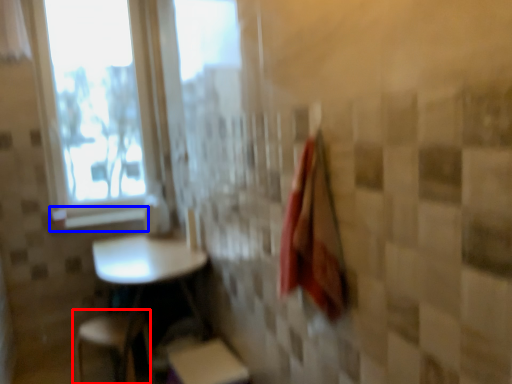
Question: Among these objects, which one is farthest to the camera, step stool (highlighted by a red box) or window sill (highlighted by a blue box)?

Choices:
 (A) step stool
 (B) window sill

Answer: (B)